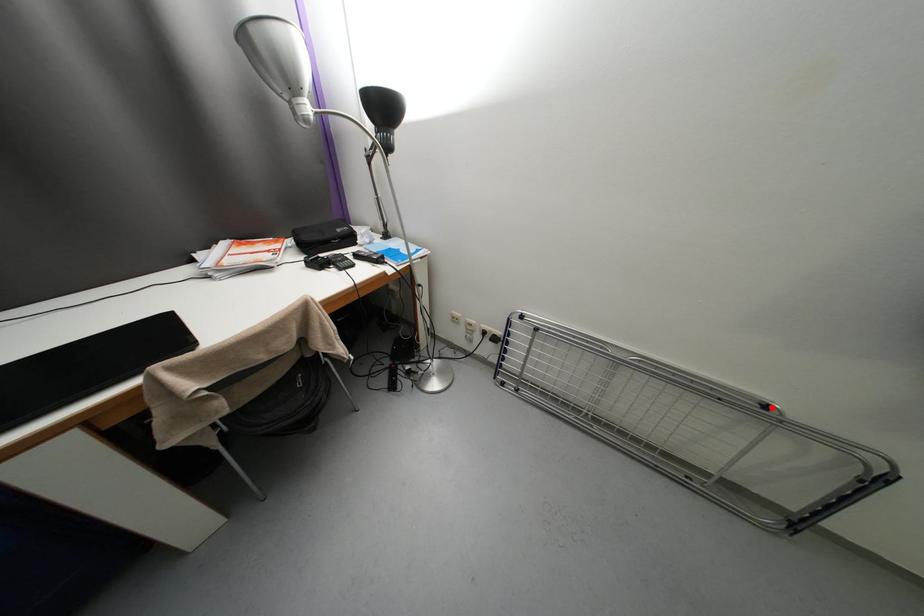
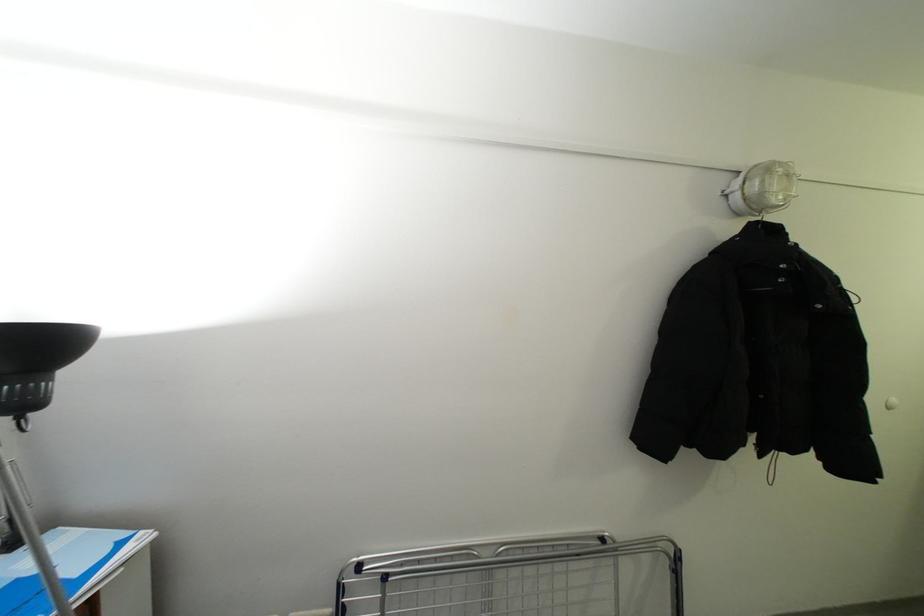
The point at the highlighted location is marked in the first image. Where is the corresponding point in the second image?

(609, 541)